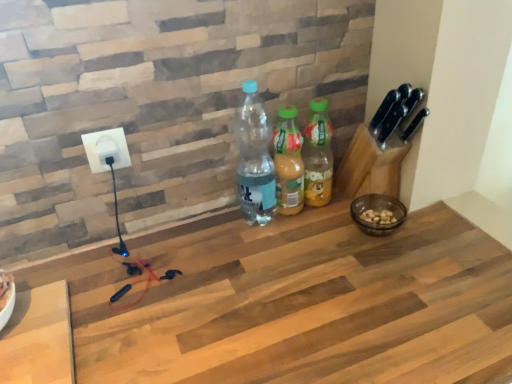
Question: Considering the relative sizes of transparent plastic bottle at center, the third bottle from the right, and translucent plastic bottle at center, which is the third bottle from left to right, in the image provided, is transparent plastic bottle at center, the third bottle from the right, bigger than translucent plastic bottle at center, which is the third bottle from left to right,?

Choices:
 (A) yes
 (B) no

Answer: (A)

Question: Can you confirm if transparent plastic bottle at center, the third bottle from the right, is shorter than translucent plastic bottle at center, which is the third bottle from left to right?

Choices:
 (A) yes
 (B) no

Answer: (B)

Question: Is transparent plastic bottle at center, the third bottle from the right, wider than translucent plastic bottle at center, arranged as the first bottle when viewed from the right?

Choices:
 (A) yes
 (B) no

Answer: (A)

Question: From the image's perspective, is transparent plastic bottle at center, which is the first bottle in left-to-right order, over translucent plastic bottle at center, which is the third bottle from left to right?

Choices:
 (A) no
 (B) yes

Answer: (A)

Question: From the image's perspective, would you say transparent plastic bottle at center, which is the first bottle in left-to-right order, is shown under translucent plastic bottle at center, which is the third bottle from left to right?

Choices:
 (A) yes
 (B) no

Answer: (A)

Question: Is transparent plastic bottle at center, the third bottle from the right, looking in the opposite direction of translucent plastic bottle at center, which is the third bottle from left to right?

Choices:
 (A) yes
 (B) no

Answer: (B)

Question: From a real-world perspective, is wooden at center under translucent plastic bottle at center, which is the third bottle from left to right?

Choices:
 (A) yes
 (B) no

Answer: (A)

Question: From the image's perspective, is wooden at center below translucent plastic bottle at center, which is the third bottle from left to right?

Choices:
 (A) yes
 (B) no

Answer: (A)

Question: From a real-world perspective, is wooden at center on top of translucent plastic bottle at center, which is the third bottle from left to right?

Choices:
 (A) yes
 (B) no

Answer: (B)

Question: Is wooden at center positioned far away from translucent plastic bottle at center, which is the third bottle from left to right?

Choices:
 (A) no
 (B) yes

Answer: (A)

Question: From the image's perspective, does wooden at center appear higher than translucent plastic bottle at center, arranged as the first bottle when viewed from the right?

Choices:
 (A) no
 (B) yes

Answer: (A)

Question: Can you confirm if wooden at center is smaller than translucent plastic bottle at center, arranged as the first bottle when viewed from the right?

Choices:
 (A) no
 (B) yes

Answer: (A)

Question: From a real-world perspective, does white plastic socket at upper left sit lower than translucent plastic bottle at center, which is counted as the second bottle, starting from the right?

Choices:
 (A) yes
 (B) no

Answer: (B)